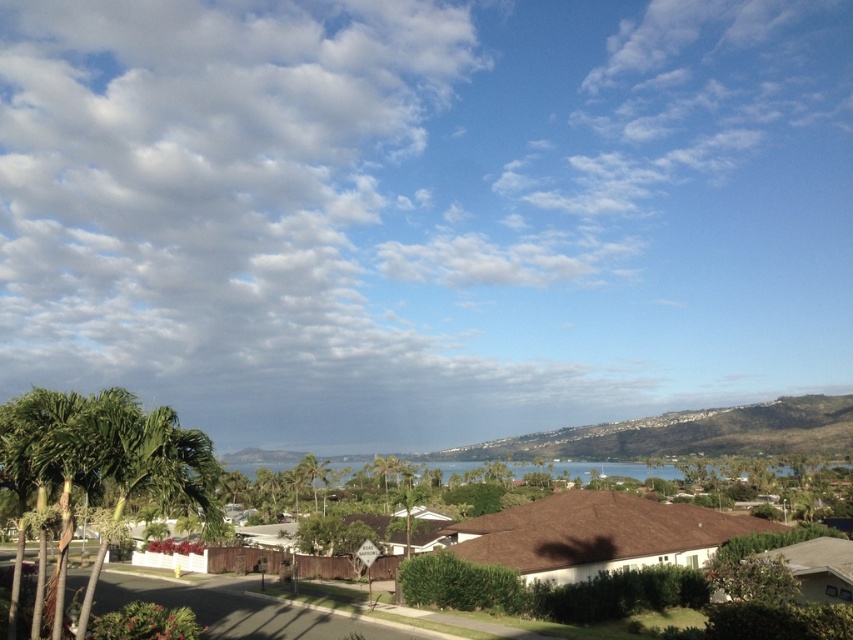
Between white fluffy cloud at upper center and green leafy palm tree at lower left, which one appears on the left side from the viewer's perspective?

From the viewer's perspective, green leafy palm tree at lower left appears more on the left side.

Is the position of white fluffy cloud at upper center less distant than that of green leafy palm tree at lower left?

No.

Does point (51, 157) come behind point (99, 451)?

That is True.

Where is `white fluffy cloud at upper center`? This screenshot has width=853, height=640. white fluffy cloud at upper center is located at coordinates (425, 211).

Does green leafy palm tree at lower left have a lesser height compared to green leafy palm tree at center?

No.

Is green leafy palm tree at lower left below green leafy palm tree at center?

Incorrect, green leafy palm tree at lower left is not positioned below green leafy palm tree at center.

Is point (184, 449) in front of point (323, 472)?

Yes, point (184, 449) is closer to viewer.

This screenshot has height=640, width=853. Find the location of `green leafy palm tree at lower left`. green leafy palm tree at lower left is located at coordinates (103, 461).

Describe the element at coordinates (425, 211) in the screenshot. I see `white fluffy cloud at upper center` at that location.

Which is in front, point (592, 394) or point (305, 456)?

Point (305, 456) is more forward.

Locate an element on the screen. white fluffy cloud at upper center is located at coordinates (425, 211).